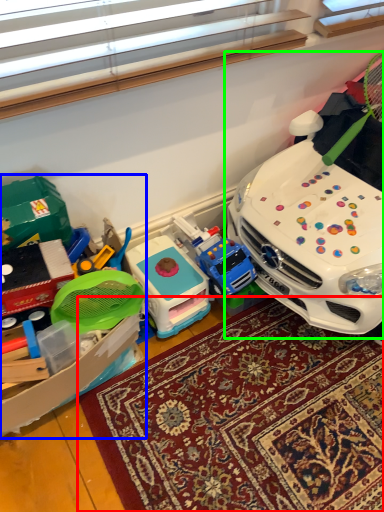
Question: Based on their relative distances, which object is farther from mat (highlighted by a red box)? Choose from toy (highlighted by a blue box) and toy (highlighted by a green box).

Choices:
 (A) toy
 (B) toy

Answer: (B)